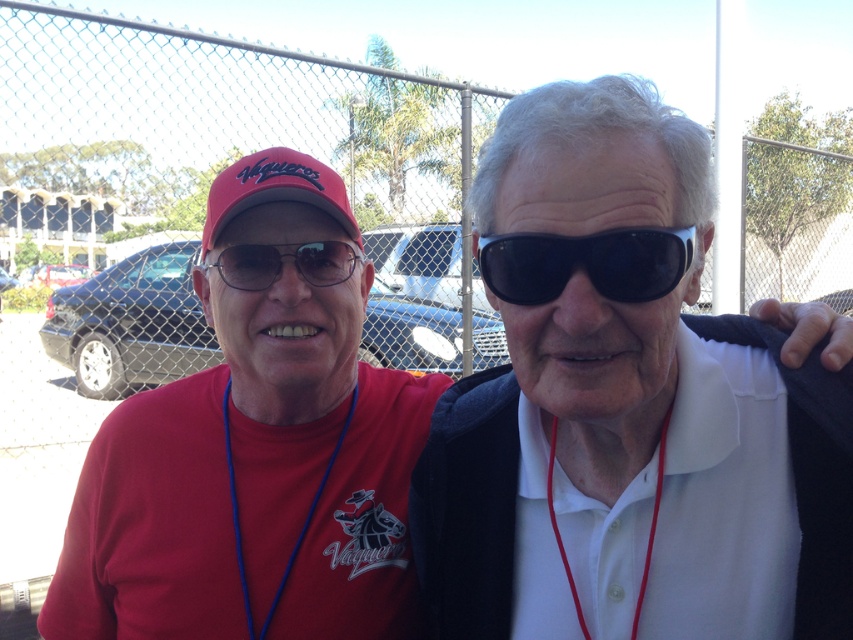
Question: Is the position of matte red cap at left less distant than that of matte black goggles at center?

Choices:
 (A) yes
 (B) no

Answer: (A)

Question: Can you confirm if white matte sunglasses at upper right is positioned to the right of black plastic sunglasses at upper center?

Choices:
 (A) no
 (B) yes

Answer: (B)

Question: Does white matte sunglasses at upper right come behind matte red baseball cap at upper left?

Choices:
 (A) yes
 (B) no

Answer: (B)

Question: Which of the following is the farthest from the observer?

Choices:
 (A) (601, 234)
 (B) (231, 184)
 (C) (628, 509)

Answer: (B)

Question: Which point is farther to the camera?

Choices:
 (A) black plastic sunglasses at upper center
 (B) white matte sunglasses at upper right

Answer: (A)

Question: Which object is the farthest from the matte red cap at left?

Choices:
 (A) matte black goggles at center
 (B) matte red baseball cap at upper left
 (C) white matte sunglasses at upper right
 (D) black plastic sunglasses at upper center

Answer: (D)